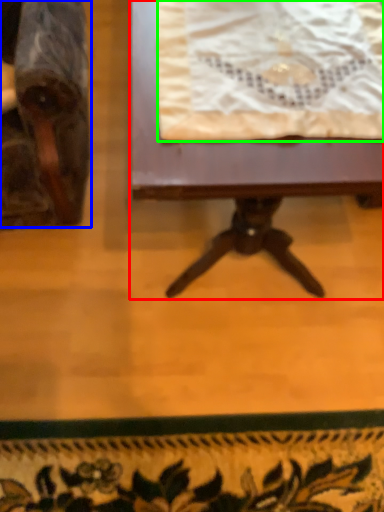
Question: Considering the real-world distances, which object is closest to table (highlighted by a red box)? chair (highlighted by a blue box) or blanket (highlighted by a green box).

Choices:
 (A) chair
 (B) blanket

Answer: (B)